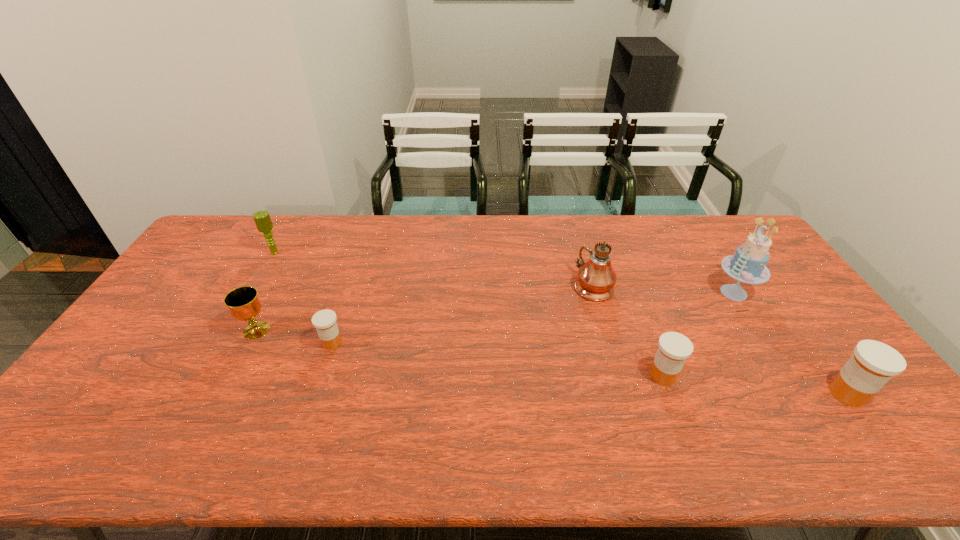
Find the location of a particular element. Image resolution: width=960 pixels, height=540 pixels. cake is located at coordinates (748, 264).

Find the location of a particular element. the fourth object from left to right is located at coordinates (596, 278).

Where is `vacant area situated on the label of the leftmost medicine`? The width and height of the screenshot is (960, 540). vacant area situated on the label of the leftmost medicine is located at coordinates [311, 406].

This screenshot has width=960, height=540. I want to click on blank space located on the label of the tallest medicine, so click(780, 394).

You are a GUI agent. You are given a task and a screenshot of the screen. Output one action in this format:
    pyautogui.click(x=<x>, y=<y>)
    Task: Click on the vacant region located on the label of the tallest medicine
    The width and height of the screenshot is (960, 540).
    Given the screenshot: What is the action you would take?
    pyautogui.click(x=674, y=394)

Where is `blank area located on the label of the tallest medicine`? Image resolution: width=960 pixels, height=540 pixels. blank area located on the label of the tallest medicine is located at coordinates (713, 394).

Identify the location of vacant region located on the right of the farthest object. (300, 253).

Locate an element on the screen. Image resolution: width=960 pixels, height=540 pixels. free space located on the back of the chalice is located at coordinates (295, 256).

Locate an element on the screen. This screenshot has width=960, height=540. free space located with a ladder on the side of the cake is located at coordinates (617, 293).

At what (x,y) coordinates should I click in order to perform the action: click on vacant space located 0.390m with a ladder on the side of the cake. Please return your answer as a coordinate pair (x, y). Looking at the image, I should click on (589, 293).